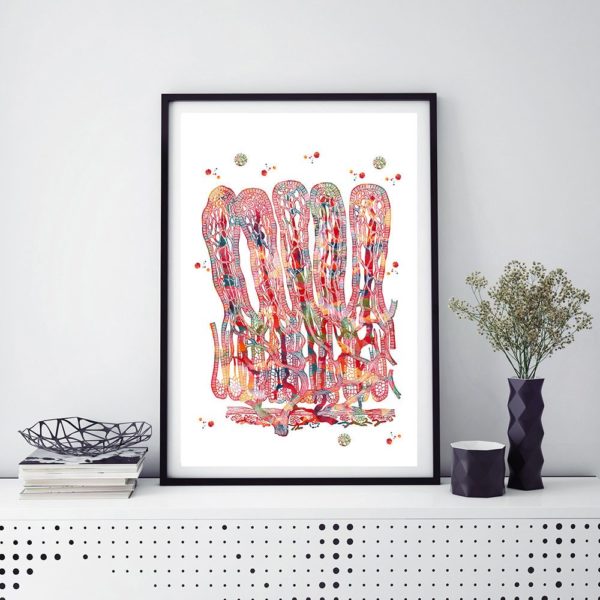
Identify the location of picture frame. The image size is (600, 600). (432, 482).